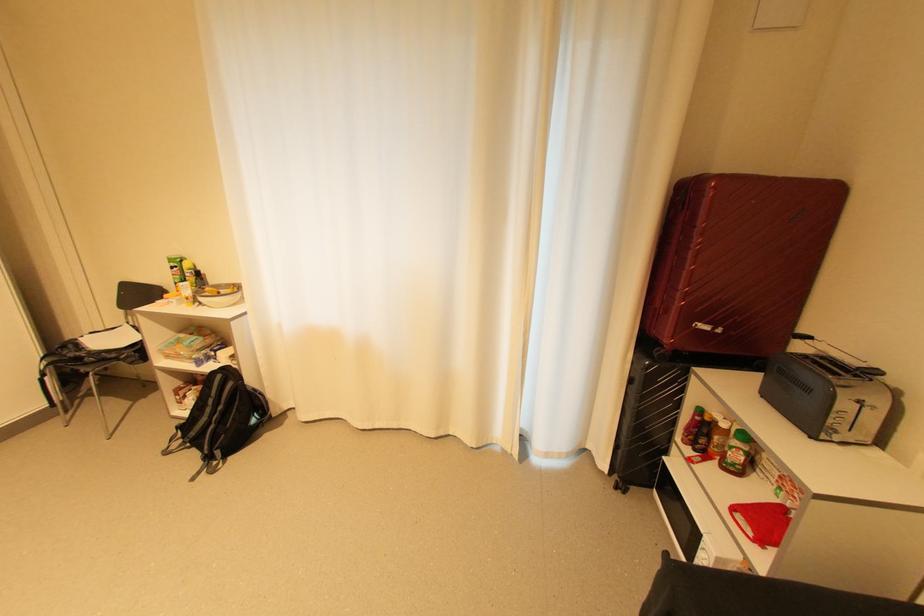
The location [186,294] corresponds to which object?

This point indicates the yellow sauce bottle.